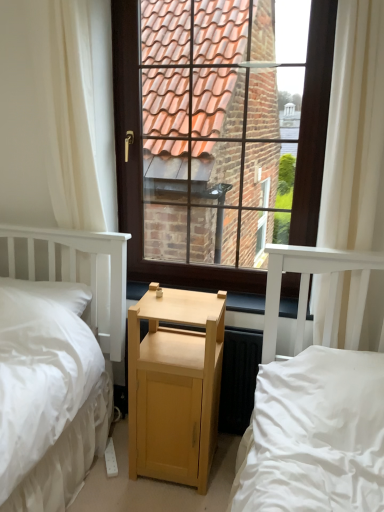
Question: Is light wood bed at center located within white sheer curtain at left, positioned as the second curtain in right-to-left order?

Choices:
 (A) no
 (B) yes

Answer: (A)

Question: Does white sheer curtain at left, the 1th curtain viewed from the left, touch light wood bed at center?

Choices:
 (A) no
 (B) yes

Answer: (A)

Question: Considering the relative sizes of white sheer curtain at left, the 1th curtain viewed from the left, and light wood bed at center in the image provided, is white sheer curtain at left, the 1th curtain viewed from the left, shorter than light wood bed at center?

Choices:
 (A) yes
 (B) no

Answer: (B)

Question: Does white sheer curtain at left, the 1th curtain viewed from the left, lie in front of light wood bed at center?

Choices:
 (A) yes
 (B) no

Answer: (B)

Question: Can we say white sheer curtain at left, the 1th curtain viewed from the left, lies outside light wood bed at center?

Choices:
 (A) no
 (B) yes

Answer: (B)

Question: In the image, is wooden at center on the left side or the right side of white sheer curtain at left, positioned as the second curtain in right-to-left order?

Choices:
 (A) right
 (B) left

Answer: (A)

Question: From the image's perspective, is wooden at center positioned above or below white sheer curtain at left, positioned as the second curtain in right-to-left order?

Choices:
 (A) above
 (B) below

Answer: (B)

Question: Is wooden at center wider or thinner than white sheer curtain at left, positioned as the second curtain in right-to-left order?

Choices:
 (A) thin
 (B) wide

Answer: (B)

Question: From a real-world perspective, is wooden at center physically located above or below white sheer curtain at left, the 1th curtain viewed from the left?

Choices:
 (A) above
 (B) below

Answer: (B)

Question: In terms of height, does wooden at center look taller or shorter compared to light wood bed at center?

Choices:
 (A) tall
 (B) short

Answer: (B)

Question: Is wooden at center inside the boundaries of light wood bed at center, or outside?

Choices:
 (A) inside
 (B) outside

Answer: (B)

Question: Is wooden at center wider or thinner than light wood bed at center?

Choices:
 (A) wide
 (B) thin

Answer: (B)

Question: Relative to light wood bed at center, is wooden at center in front or behind?

Choices:
 (A) behind
 (B) front

Answer: (A)

Question: Is white soft pillow at left in front of or behind brown wooden window at center in the image?

Choices:
 (A) behind
 (B) front

Answer: (A)

Question: Does point (26, 280) appear closer or farther from the camera than point (183, 202)?

Choices:
 (A) farther
 (B) closer

Answer: (B)